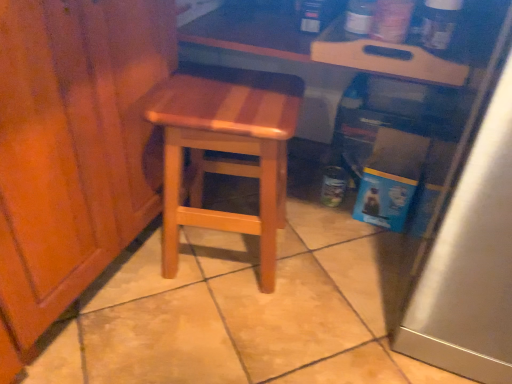
This screenshot has height=384, width=512. What are the coordinates of `free location to the right of natural wood stool at center` in the screenshot? It's located at tap(329, 263).